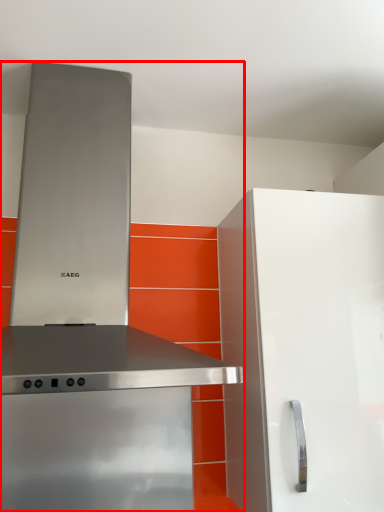
Question: From the image's perspective, where is home appliance (annotated by the red box) located in relation to cabinetry in the image?

Choices:
 (A) below
 (B) above

Answer: (B)